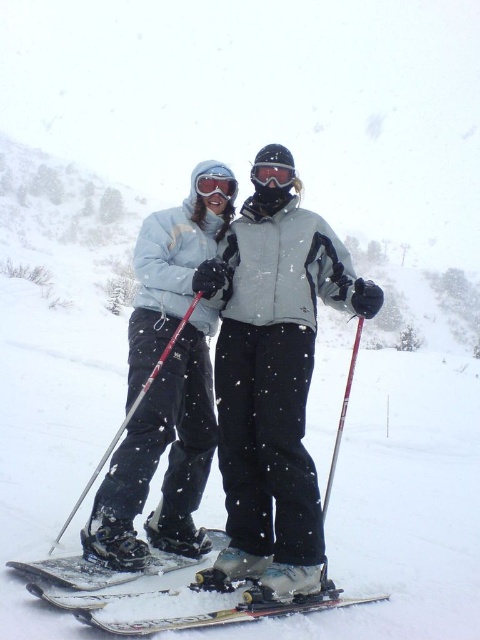
In the scene shown: Does matte gray ski jacket at center have a lesser width compared to shiny metallic ski at center?

No, matte gray ski jacket at center is not thinner than shiny metallic ski at center.

Describe the element at coordinates (274, 387) in the screenshot. I see `matte gray ski jacket at center` at that location.

Image resolution: width=480 pixels, height=640 pixels. What are the coordinates of `matte gray ski jacket at center` in the screenshot? It's located at (274, 387).

Is white matte skis at center shorter than metallic skis at center?

No.

Does white matte skis at center appear over metallic skis at center?

Yes, white matte skis at center is above metallic skis at center.

This screenshot has width=480, height=640. Identify the location of white matte skis at center. (163, 595).

Is point (109, 451) positioned after point (200, 195)?

No.

Which is in front, point (168, 342) or point (205, 186)?

Point (168, 342) is more forward.

Identify the location of metallic silver ski pole at center. (127, 419).